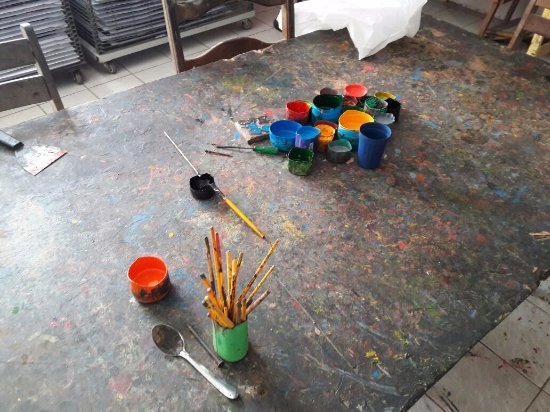
Where is `silver spoon`? The height and width of the screenshot is (412, 550). silver spoon is located at coordinates (167, 340).